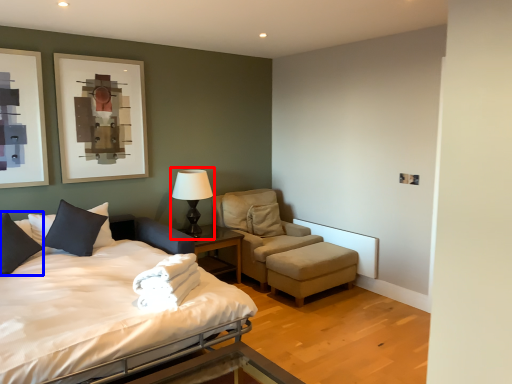
Question: Which of the following is the farthest to the observer, table lamp (highlighted by a red box) or pillow (highlighted by a blue box)?

Choices:
 (A) table lamp
 (B) pillow

Answer: (A)